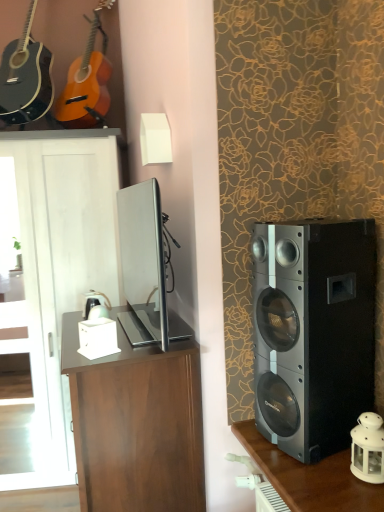
Question: Is white matte lampshade at upper center further to the viewer compared to black metallic speaker at right?

Choices:
 (A) no
 (B) yes

Answer: (B)

Question: From the image's perspective, is white matte lampshade at upper center below black metallic speaker at right?

Choices:
 (A) no
 (B) yes

Answer: (A)

Question: Is white matte lampshade at upper center closer to camera compared to black metallic speaker at right?

Choices:
 (A) no
 (B) yes

Answer: (A)

Question: Is white matte lampshade at upper center turned away from black metallic speaker at right?

Choices:
 (A) yes
 (B) no

Answer: (B)

Question: From a real-world perspective, does white matte lampshade at upper center sit lower than black metallic speaker at right?

Choices:
 (A) yes
 (B) no

Answer: (B)

Question: Is white matte lampshade at upper center smaller than black metallic speaker at right?

Choices:
 (A) yes
 (B) no

Answer: (A)

Question: Is satin silver tv at center shorter than matte wood guitar at upper left, arranged as the first guitar when viewed from the right?

Choices:
 (A) yes
 (B) no

Answer: (A)

Question: Is matte wood guitar at upper left, arranged as the first guitar when viewed from the right, located within satin silver tv at center?

Choices:
 (A) no
 (B) yes

Answer: (A)

Question: Considering the relative positions of satin silver tv at center and matte wood guitar at upper left, arranged as the first guitar when viewed from the right, in the image provided, is satin silver tv at center to the right of matte wood guitar at upper left, arranged as the first guitar when viewed from the right, from the viewer's perspective?

Choices:
 (A) yes
 (B) no

Answer: (A)

Question: Can you confirm if satin silver tv at center is thinner than matte wood guitar at upper left, which appears as the 2th guitar when viewed from the left?

Choices:
 (A) no
 (B) yes

Answer: (B)

Question: Is satin silver tv at center oriented away from matte wood guitar at upper left, arranged as the first guitar when viewed from the right?

Choices:
 (A) yes
 (B) no

Answer: (B)

Question: Does satin silver tv at center have a larger size compared to matte wood guitar at upper left, arranged as the first guitar when viewed from the right?

Choices:
 (A) no
 (B) yes

Answer: (A)

Question: From the image's perspective, is dark wood shelf at right beneath satin silver tv at center?

Choices:
 (A) no
 (B) yes

Answer: (B)